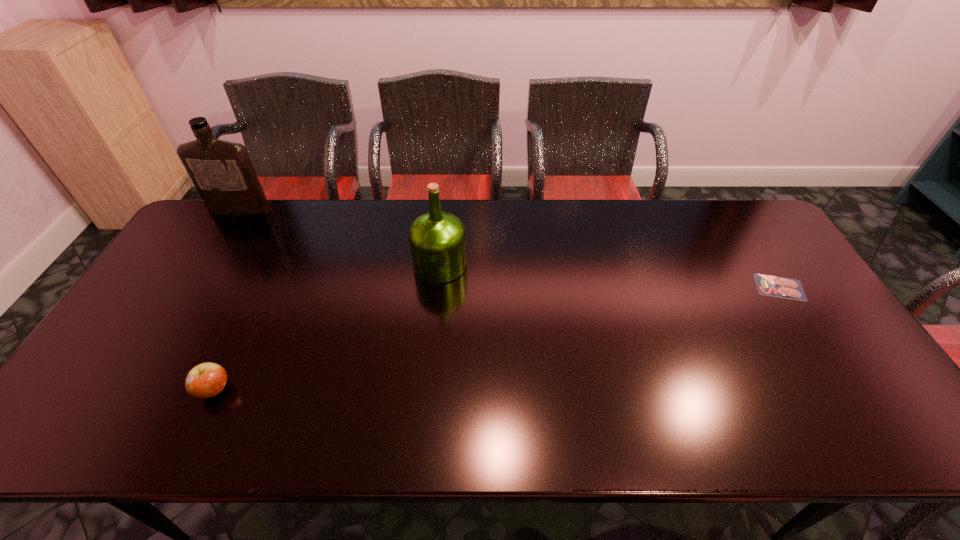
You are a GUI agent. You are given a task and a screenshot of the screen. Output one action in this format:
    pyautogui.click(x=<x>, y=<y>)
    Task: Click on the leftmost object
    This screenshot has width=960, height=540.
    Given the screenshot: What is the action you would take?
    pyautogui.click(x=222, y=172)

Locate an element on the screen. This screenshot has height=540, width=960. liquor is located at coordinates [x=222, y=172].

The height and width of the screenshot is (540, 960). What are the coordinates of `the third object from left to right` in the screenshot? It's located at (437, 239).

What are the coordinates of `the second tallest object` in the screenshot? It's located at (437, 239).

Image resolution: width=960 pixels, height=540 pixels. I want to click on the nearest object, so click(x=206, y=380).

This screenshot has height=540, width=960. Find the location of `the third object from right to left`. the third object from right to left is located at coordinates (206, 380).

Locate an element on the screen. This screenshot has width=960, height=540. the rightmost object is located at coordinates (782, 287).

Identify the location of the shortest object. (782, 287).

The height and width of the screenshot is (540, 960). In order to click on free point located on the label side of the liquor in this screenshot , I will do `click(206, 266)`.

Where is `free space located 0.400m on the left of the olive oil`? The height and width of the screenshot is (540, 960). free space located 0.400m on the left of the olive oil is located at coordinates tap(283, 265).